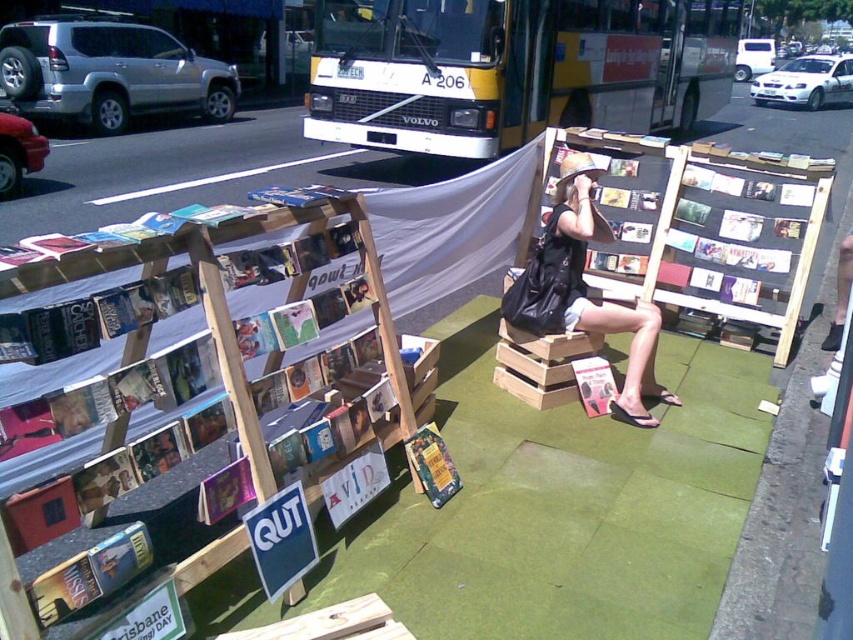
Between matte black bag at center and hardcover book at center, which one appears on the left side from the viewer's perspective?

Positioned to the left is hardcover book at center.

Image resolution: width=853 pixels, height=640 pixels. What do you see at coordinates (585, 289) in the screenshot?
I see `matte black bag at center` at bounding box center [585, 289].

Where is `matte black bag at center`? matte black bag at center is located at coordinates (585, 289).

Between point (450, 490) and point (584, 385), which one is positioned behind?

The point (584, 385) is more distant.

Who is higher up, hardcover book at center or matte pink magazine at center?

matte pink magazine at center is above.

Is point (427, 442) positioned before point (602, 400)?

Yes.

Locate an element on the screen. hardcover book at center is located at coordinates (432, 465).

Does yellow metallic bus at upper center have a lesser width compared to hardcover book at center?

Incorrect, yellow metallic bus at upper center's width is not less than hardcover book at center's.

Looking at this image, does yellow metallic bus at upper center appear over hardcover book at center?

Indeed, yellow metallic bus at upper center is positioned over hardcover book at center.

Where is `yellow metallic bus at upper center`? yellow metallic bus at upper center is located at coordinates (514, 68).